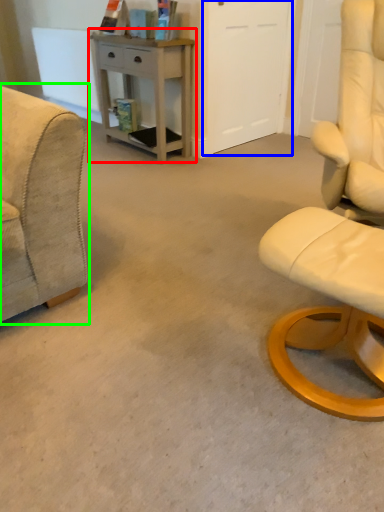
Question: Which is farther away from desk (highlighted by a red box)? glass door (highlighted by a blue box) or chair (highlighted by a green box)?

Choices:
 (A) glass door
 (B) chair

Answer: (B)